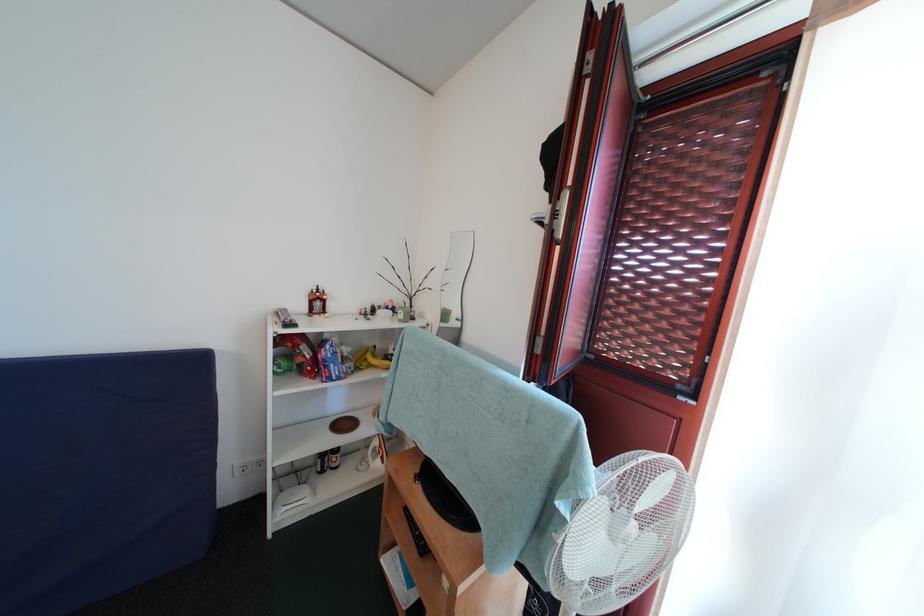
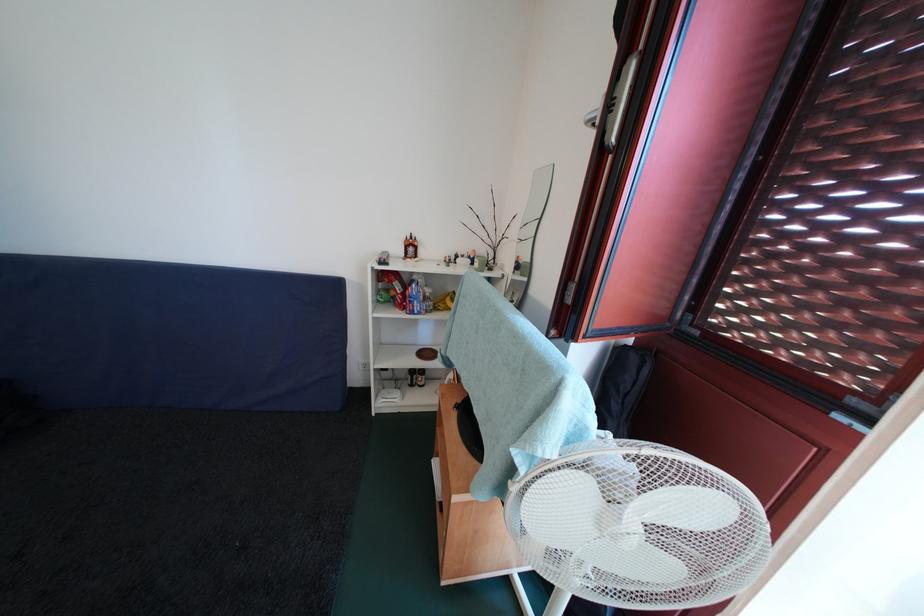
Locate, in the second image, the point that corresponds to the point at 311,361 in the first image.

(403, 296)